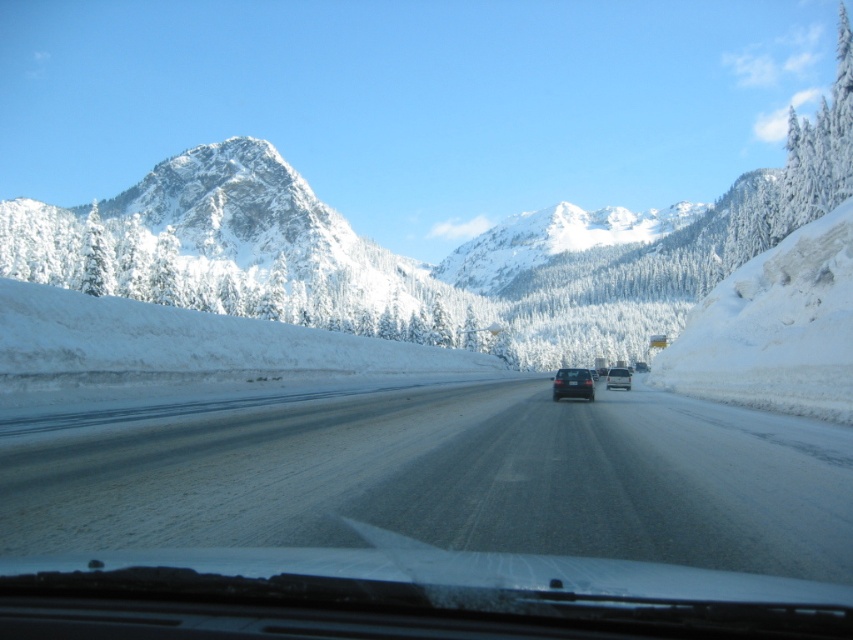
Question: Among these points, which one is farthest from the camera?

Choices:
 (A) tap(621, 385)
 (B) tap(257, 440)

Answer: (A)

Question: Is satin black sedan at center positioned behind satin silver van at center?

Choices:
 (A) no
 (B) yes

Answer: (A)

Question: Can you confirm if satin black sedan at center is thinner than satin silver van at center?

Choices:
 (A) yes
 (B) no

Answer: (A)

Question: Which point appears farthest from the camera in this image?

Choices:
 (A) (624, 378)
 (B) (560, 371)
 (C) (103, 496)

Answer: (A)

Question: Is smooth asphalt highway at center to the right of satin silver van at center from the viewer's perspective?

Choices:
 (A) yes
 (B) no

Answer: (B)

Question: Estimate the real-world distances between objects in this image. Which object is closer to the smooth asphalt highway at center?

Choices:
 (A) satin black sedan at center
 (B) satin silver van at center

Answer: (A)